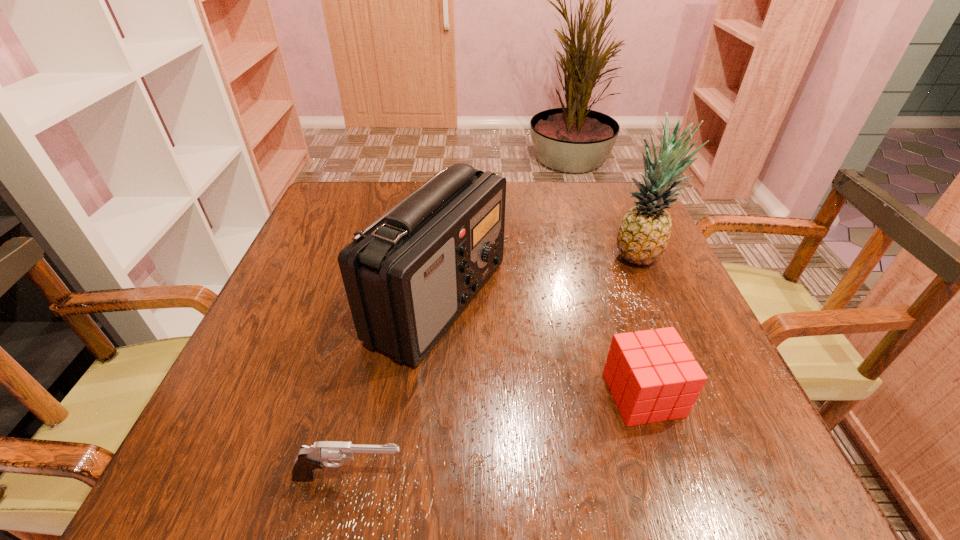
Image resolution: width=960 pixels, height=540 pixels. Find the location of `blank region between the nearest object and the cube`. blank region between the nearest object and the cube is located at coordinates (496, 436).

I want to click on vacant space in between the pineapple and the cube, so click(640, 325).

I want to click on free spot between the gun and the second tallest object, so click(x=394, y=388).

Locate an element on the screen. The image size is (960, 540). vacant area that lies between the cube and the nearest object is located at coordinates (496, 436).

Where is `vacant area between the third shortest object and the cube`? This screenshot has height=540, width=960. vacant area between the third shortest object and the cube is located at coordinates (540, 348).

This screenshot has height=540, width=960. Find the location of `empty location between the cube and the radio receiver`. empty location between the cube and the radio receiver is located at coordinates (540, 348).

The width and height of the screenshot is (960, 540). I want to click on blank region between the radio receiver and the cube, so click(x=540, y=348).

Locate an element on the screen. The image size is (960, 540). blank region between the tallest object and the cube is located at coordinates (640, 325).

I want to click on free spot between the radio receiver and the nearest object, so click(x=394, y=388).

In order to click on empty space between the radio receiver and the pineapple in this screenshot , I will do `click(538, 278)`.